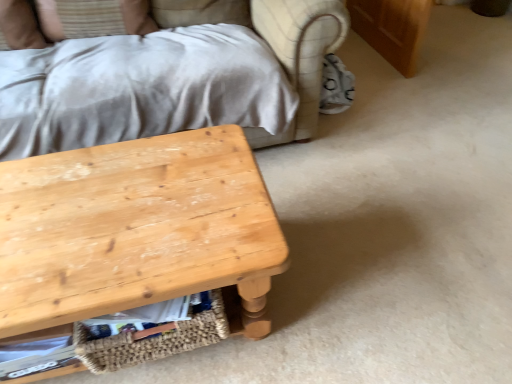
Question: From the image's perspective, is natural wood table at lower left located above or below woven straw basket at lower center?

Choices:
 (A) above
 (B) below

Answer: (A)

Question: Is natural wood table at lower left wider or thinner than woven straw basket at lower center?

Choices:
 (A) thin
 (B) wide

Answer: (B)

Question: Estimate the real-world distances between objects in this image. Which object is farther from the white fabric pillow at upper left?

Choices:
 (A) woven straw basket at lower center
 (B) natural wood table at lower left

Answer: (A)

Question: Considering the real-world distances, which object is farthest from the woven straw basket at lower center?

Choices:
 (A) natural wood table at lower left
 (B) white fabric pillow at upper left

Answer: (B)